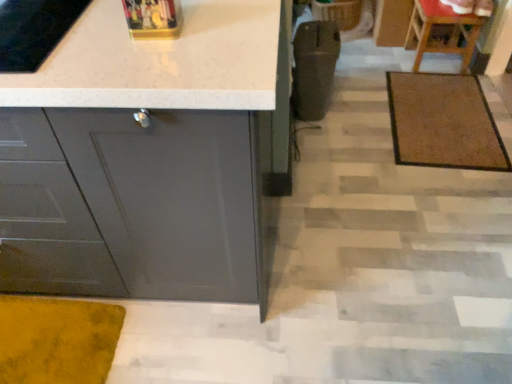
Find the location of a particular element. The image size is (512, 384). vacant region under wooden chair at upper right (from a real-world perspective) is located at coordinates 435,61.